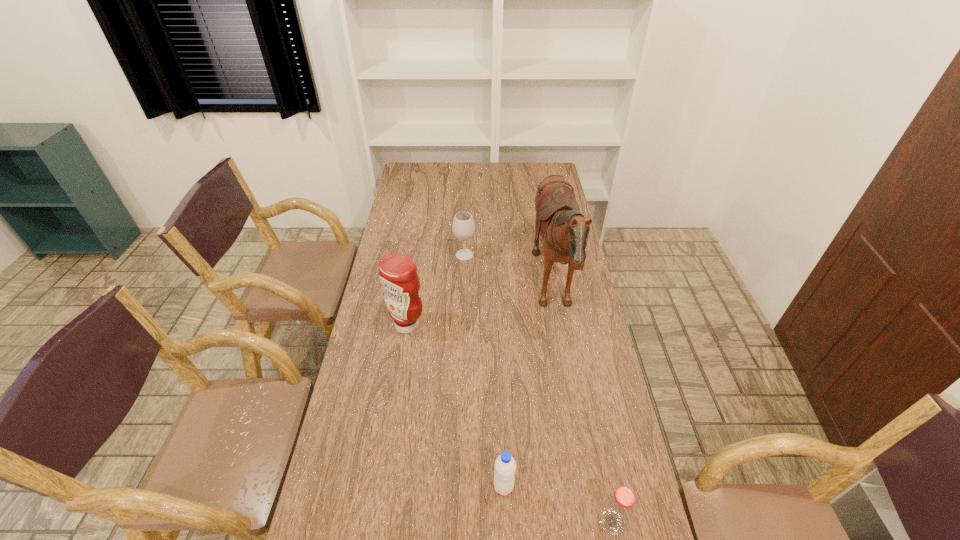
Locate which object is the closest to the bottle. Please provide its 2D coordinates. Your answer should be formatted as a tuple, i.e. [(x, y)], where the tuple contains the x and y coordinates of a point satisfying the conditions above.

[(505, 466)]

Locate an element on the screen. This screenshot has width=960, height=540. blank area in the image that satisfies the following two spatial constraints: 1. on the front side of the third object from right to left; 2. on the left side of the fourth shortest object is located at coordinates (381, 487).

Where is `free location that satisfies the following two spatial constraints: 1. on the back side of the condiment; 2. on the right side of the second object from left to right`? This screenshot has height=540, width=960. free location that satisfies the following two spatial constraints: 1. on the back side of the condiment; 2. on the right side of the second object from left to right is located at coordinates (418, 255).